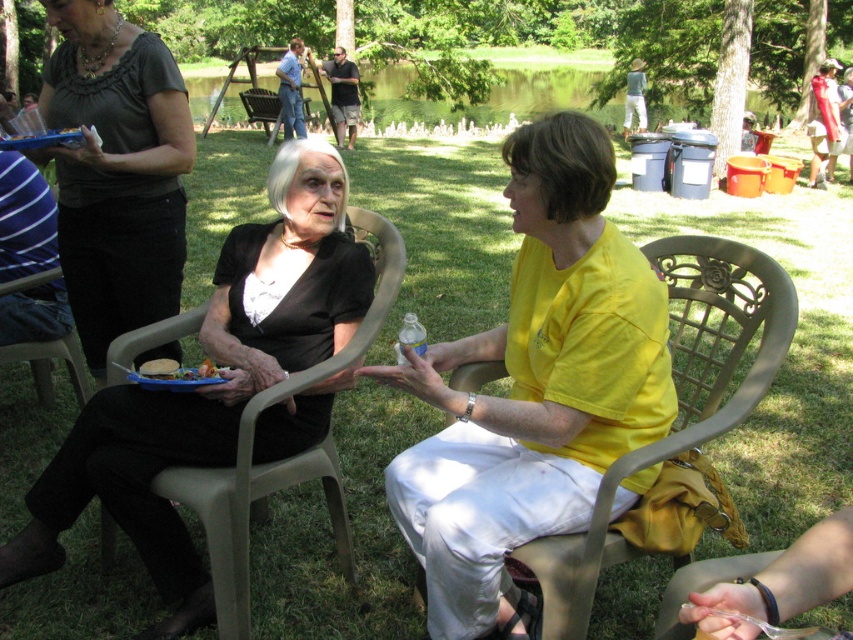
Which is below, beige plastic chair at center or plastic chair at center?

plastic chair at center is lower down.

This screenshot has width=853, height=640. Find the location of `beige plastic chair at center`. beige plastic chair at center is located at coordinates (682, 401).

Who is positioned more to the right, matte black dress at left or plastic chair at lower left?

matte black dress at left is more to the right.

Can you confirm if matte black dress at left is positioned below plastic chair at lower left?

No.

Does point (113, 208) come closer to viewer compared to point (55, 344)?

Yes, it is in front of point (55, 344).

Where is `matte black dress at left`? This screenshot has width=853, height=640. matte black dress at left is located at coordinates (115, 170).

Does plastic chair at center come in front of brown plastic chair at center?

Yes, it is in front of brown plastic chair at center.

Between plastic chair at center and brown plastic chair at center, which one appears on the left side from the viewer's perspective?

brown plastic chair at center is more to the left.

Identify the location of plastic chair at center. The image size is (853, 640). (286, 458).